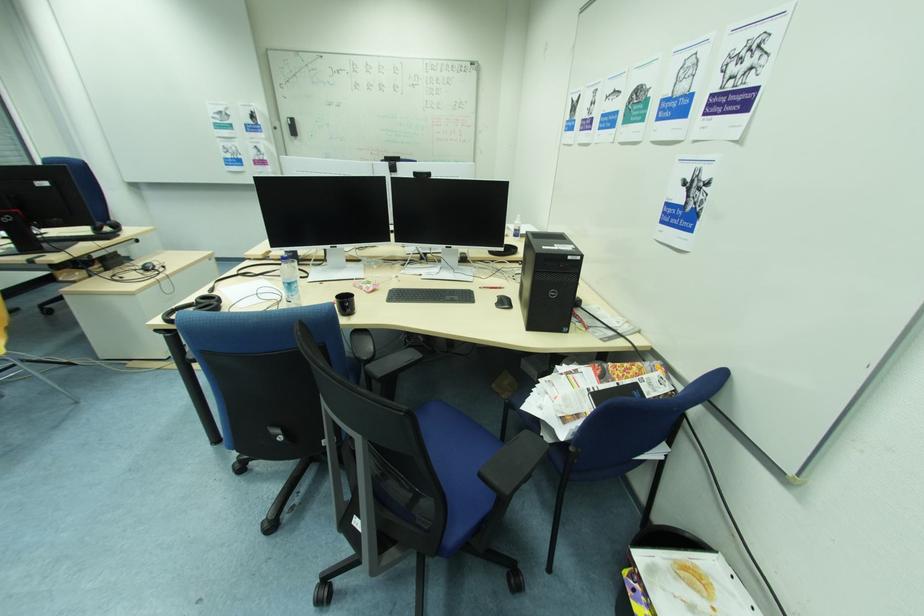
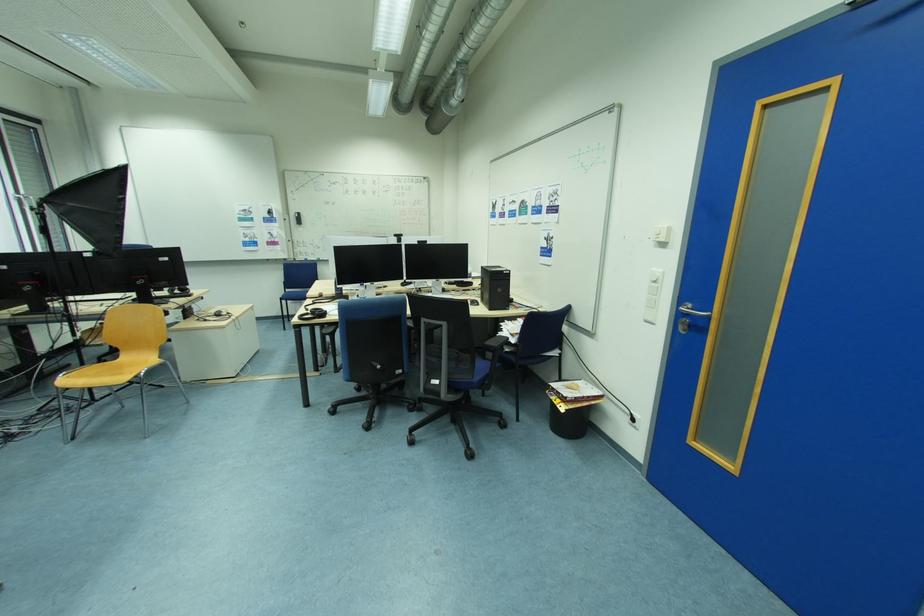
In the second image, find the point that corresponds to (217,292) in the first image.

(313, 310)